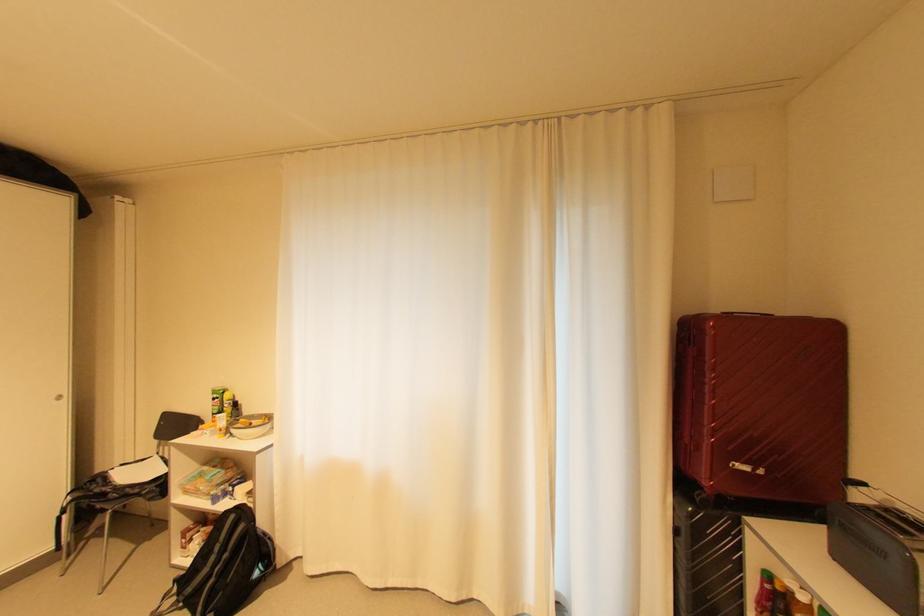
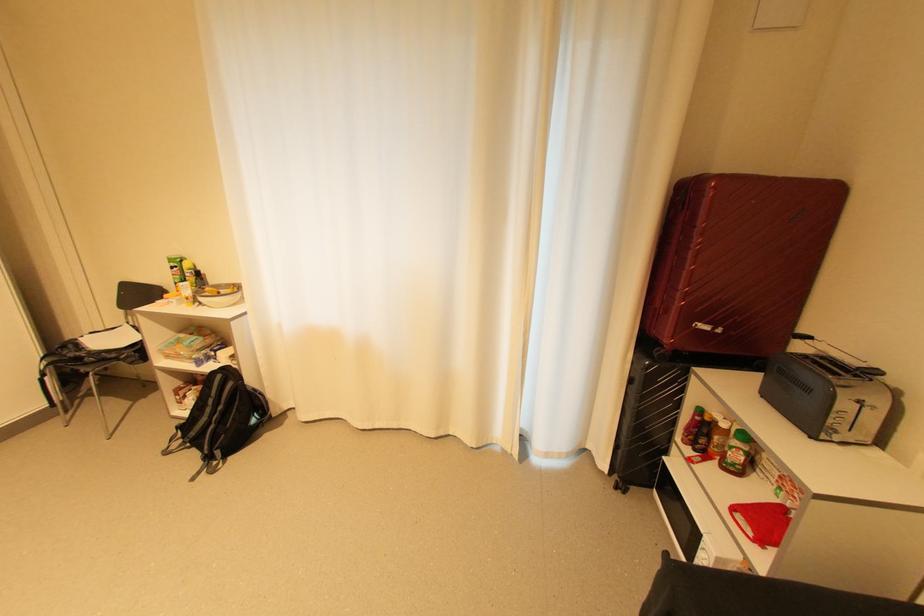
Where in the second image is the point corresponding to (225,400) from the first image?

(184, 270)